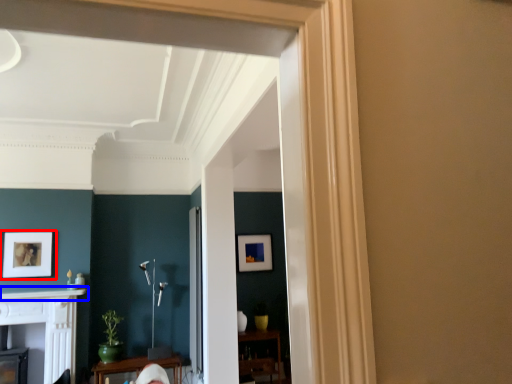
Question: Among these objects, which one is nearest to the camera, picture frame (highlighted by a red box) or mantle (highlighted by a blue box)?

Choices:
 (A) picture frame
 (B) mantle

Answer: (B)